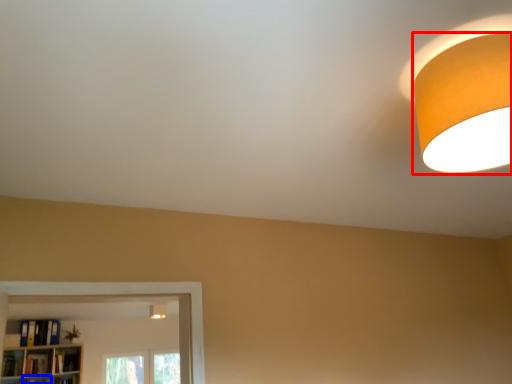
Question: Which object is closer to the camera taking this photo, lamp (highlighted by a red box) or shelf (highlighted by a blue box)?

Choices:
 (A) lamp
 (B) shelf

Answer: (A)